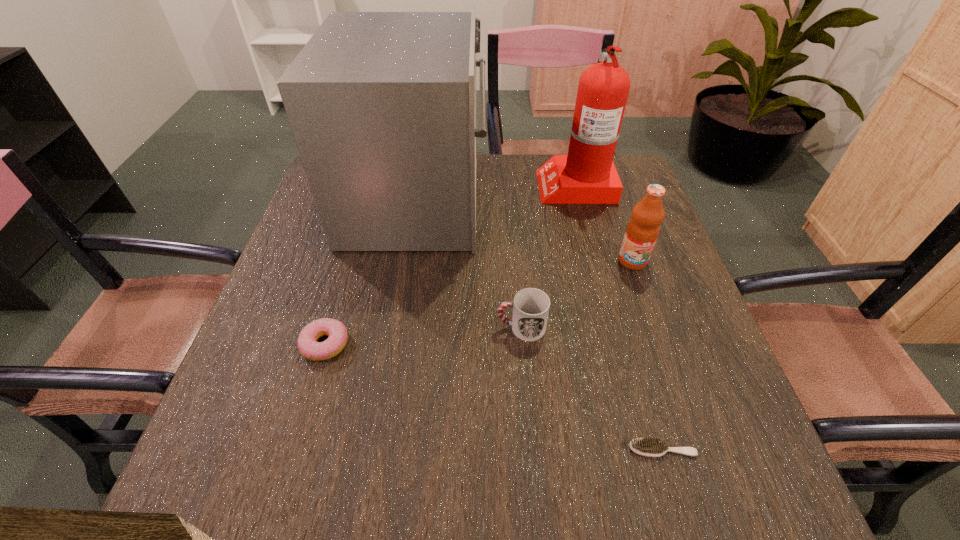
The height and width of the screenshot is (540, 960). I want to click on object located in the near edge section of the desktop, so click(x=647, y=446).

This screenshot has height=540, width=960. Identify the location of toaster oven present at the left edge. (382, 105).

Image resolution: width=960 pixels, height=540 pixels. I want to click on doughnut that is at the left edge, so click(x=308, y=346).

You are a GUI agent. You are given a task and a screenshot of the screen. Output one action in this format:
    pyautogui.click(x=<x>, y=<y>)
    Task: Click on the fire extinguisher at the right edge
    The width and height of the screenshot is (960, 540).
    Given the screenshot: What is the action you would take?
    pyautogui.click(x=587, y=175)

Image resolution: width=960 pixels, height=540 pixels. In order to click on fruit juice present at the right edge in this screenshot , I will do `click(642, 230)`.

The image size is (960, 540). In order to click on scrubbing brush that is at the right edge in this screenshot , I will do `click(647, 446)`.

This screenshot has height=540, width=960. I want to click on object that is positioned at the far left corner, so click(382, 105).

Image resolution: width=960 pixels, height=540 pixels. What are the coordinates of `object positioned at the far right corner` in the screenshot? It's located at (587, 175).

The image size is (960, 540). Identify the location of object that is positioned at the near right corner. (647, 446).

At what (x,y) coordinates should I click in order to perform the action: click on vacant space at the far edge of the desktop. Please return your answer as a coordinate pair (x, y). Looking at the image, I should click on tap(484, 194).